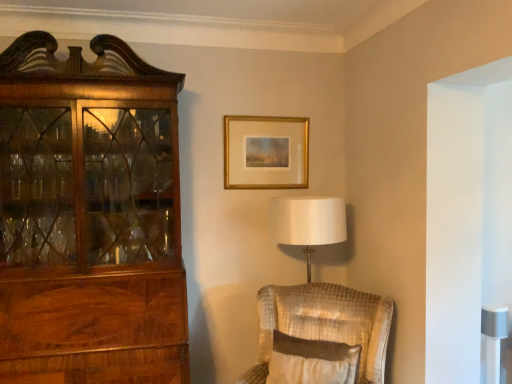
You are a GUI agent. You are given a task and a screenshot of the screen. Output one action in this format:
    pyautogui.click(x=<x>, y=<y>)
    Task: Click on the white textured pillow at center
    
    Given the screenshot: What is the action you would take?
    pyautogui.click(x=312, y=361)

The height and width of the screenshot is (384, 512). What do you see at coordinates (324, 324) in the screenshot?
I see `velvet beige chair at lower right` at bounding box center [324, 324].

Image resolution: width=512 pixels, height=384 pixels. In order to click on white textured pillow at center in this screenshot , I will do `click(312, 361)`.

Considering the relative sizes of gold metallic picture frame at upper center and velvet beige chair at lower right in the image provided, is gold metallic picture frame at upper center bigger than velvet beige chair at lower right?

No, gold metallic picture frame at upper center is not bigger than velvet beige chair at lower right.

Which of these two, gold metallic picture frame at upper center or velvet beige chair at lower right, is wider?

velvet beige chair at lower right is wider.

Does point (270, 128) come closer to viewer compared to point (360, 314)?

No, (270, 128) is further to viewer.

This screenshot has width=512, height=384. What are the coordinates of `chair below the gold metallic picture frame at upper center (from the image's perspective)` in the screenshot? It's located at 324,324.

Does gold metallic picture frame at upper center come in front of white textured pillow at center?

No, gold metallic picture frame at upper center is behind white textured pillow at center.

Is point (298, 171) farther from viewer compared to point (314, 362)?

Yes, point (298, 171) is behind point (314, 362).

Find the location of a particular element. This screenshot has width=512, height=384. picture frame on the left of white textured pillow at center is located at coordinates (266, 152).

Is gold metallic picture frame at upper center spatially inside white textured pillow at center, or outside of it?

gold metallic picture frame at upper center is not enclosed by white textured pillow at center.

In the scene shown: Considering the relative positions of velvet beige chair at lower right and white textured pillow at center in the image provided, is velvet beige chair at lower right behind white textured pillow at center?

Yes.

Is velvet beige chair at lower right bigger or smaller than white textured pillow at center?

Answer: Considering their sizes, velvet beige chair at lower right takes up more space than white textured pillow at center.

From the image's perspective, which one is positioned higher, velvet beige chair at lower right or white textured pillow at center?

velvet beige chair at lower right.

Which of these two, velvet beige chair at lower right or white textured pillow at center, stands shorter?

white textured pillow at center is shorter.

Which of these two, white textured pillow at center or velvet beige chair at lower right, stands taller?

velvet beige chair at lower right.

Does white textured pillow at center have a smaller size compared to velvet beige chair at lower right?

Yes.

Does white textured pillow at center have a greater width compared to velvet beige chair at lower right?

No.

Would you say velvet beige chair at lower right is inside or outside gold metallic picture frame at upper center?

velvet beige chair at lower right is not inside gold metallic picture frame at upper center, it's outside.

Is velvet beige chair at lower right closer to camera compared to gold metallic picture frame at upper center?

Yes, it is in front of gold metallic picture frame at upper center.

From the image's perspective, relative to gold metallic picture frame at upper center, is velvet beige chair at lower right above or below?

velvet beige chair at lower right is below gold metallic picture frame at upper center.

From a real-world perspective, is velvet beige chair at lower right on top of gold metallic picture frame at upper center?

No, from a real-world perspective, velvet beige chair at lower right is not above gold metallic picture frame at upper center.

Considering the relative positions of white textured pillow at center and gold metallic picture frame at upper center in the image provided, is white textured pillow at center to the left of gold metallic picture frame at upper center from the viewer's perspective?

In fact, white textured pillow at center is to the right of gold metallic picture frame at upper center.

Considering the sizes of objects white textured pillow at center and gold metallic picture frame at upper center in the image provided, who is smaller, white textured pillow at center or gold metallic picture frame at upper center?

gold metallic picture frame at upper center is smaller.

Is point (273, 361) farther from viewer compared to point (286, 139)?

No, (273, 361) is in front of (286, 139).

Considering the relative sizes of white textured pillow at center and gold metallic picture frame at upper center in the image provided, is white textured pillow at center shorter than gold metallic picture frame at upper center?

Yes, white textured pillow at center is shorter than gold metallic picture frame at upper center.

Find the location of a particular element. picture frame that appears above the velvet beige chair at lower right (from a real-world perspective) is located at coordinates (266, 152).

Where is `pillow below the gold metallic picture frame at upper center (from a real-world perspective)`? Image resolution: width=512 pixels, height=384 pixels. pillow below the gold metallic picture frame at upper center (from a real-world perspective) is located at coordinates (312, 361).

Which object lies further to the anchor point velvet beige chair at lower right, gold metallic picture frame at upper center or white textured pillow at center?

gold metallic picture frame at upper center.

Which object lies nearer to the anchor point white textured pillow at center, velvet beige chair at lower right or gold metallic picture frame at upper center?

The object closer to white textured pillow at center is velvet beige chair at lower right.

Looking at the image, which one is located closer to white textured pillow at center, gold metallic picture frame at upper center or velvet beige chair at lower right?

Based on the image, velvet beige chair at lower right appears to be nearer to white textured pillow at center.

Considering their positions, is velvet beige chair at lower right positioned closer to gold metallic picture frame at upper center than white textured pillow at center?

Among the two, velvet beige chair at lower right is located nearer to gold metallic picture frame at upper center.

Based on their spatial positions, is white textured pillow at center or gold metallic picture frame at upper center further from velvet beige chair at lower right?

gold metallic picture frame at upper center is further to velvet beige chair at lower right.

When comparing their distances from gold metallic picture frame at upper center, does white textured pillow at center or velvet beige chair at lower right seem closer?

velvet beige chair at lower right is closer to gold metallic picture frame at upper center.

I want to click on chair between gold metallic picture frame at upper center and white textured pillow at center in the vertical direction, so click(x=324, y=324).